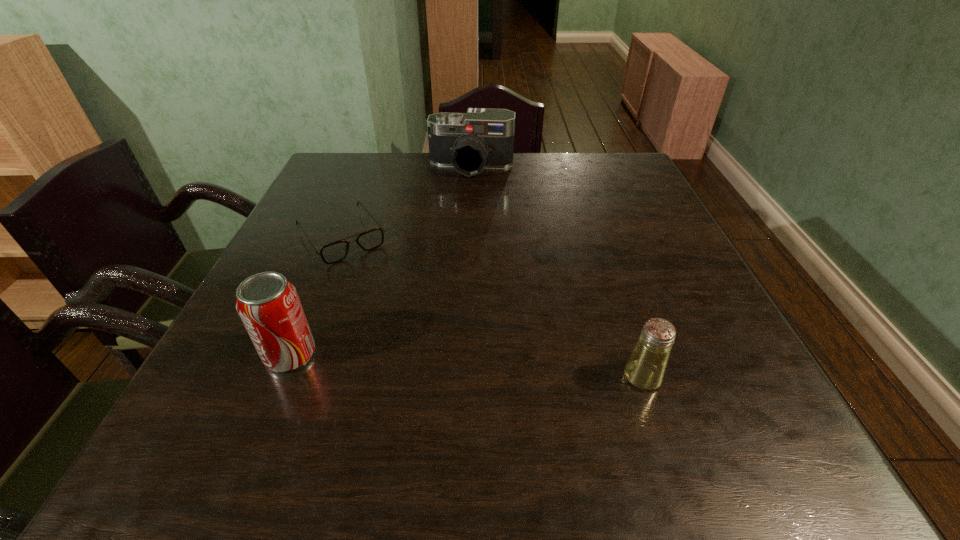
This screenshot has width=960, height=540. I want to click on object located at the near left corner, so click(x=268, y=304).

In order to click on blank area at the far edge in this screenshot , I will do `click(554, 154)`.

This screenshot has width=960, height=540. In the image, there is a desktop. What are the coordinates of `free space at the near edge` in the screenshot? It's located at (617, 401).

Where is `free space at the left edge`? The height and width of the screenshot is (540, 960). free space at the left edge is located at coordinates (305, 204).

At what (x,y) coordinates should I click in order to perform the action: click on free space at the right edge. Please return your answer as a coordinate pair (x, y). This screenshot has height=540, width=960. Looking at the image, I should click on (626, 227).

Find the location of a particular element. The width and height of the screenshot is (960, 540). vacant space at the far right corner of the desktop is located at coordinates (621, 156).

This screenshot has width=960, height=540. I want to click on vacant space at the near right corner of the desktop, so click(712, 379).

Find the location of a particular element. The image size is (960, 540). vacant point located between the sunglasses and the third tallest object is located at coordinates (492, 307).

Find the location of a particular element. free space between the soda can and the sunglasses is located at coordinates (316, 296).

This screenshot has width=960, height=540. I want to click on empty location between the sunglasses and the second object from right to left, so click(407, 202).